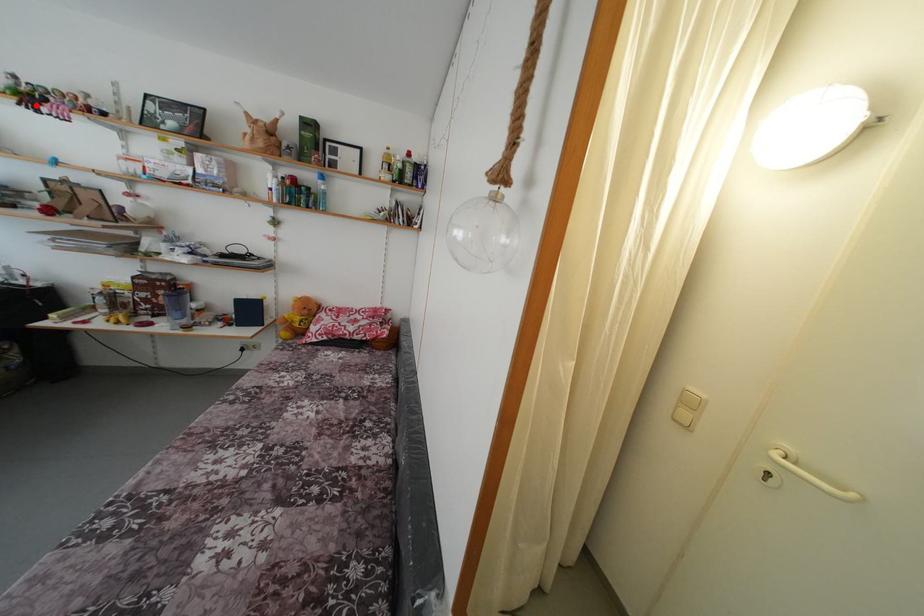
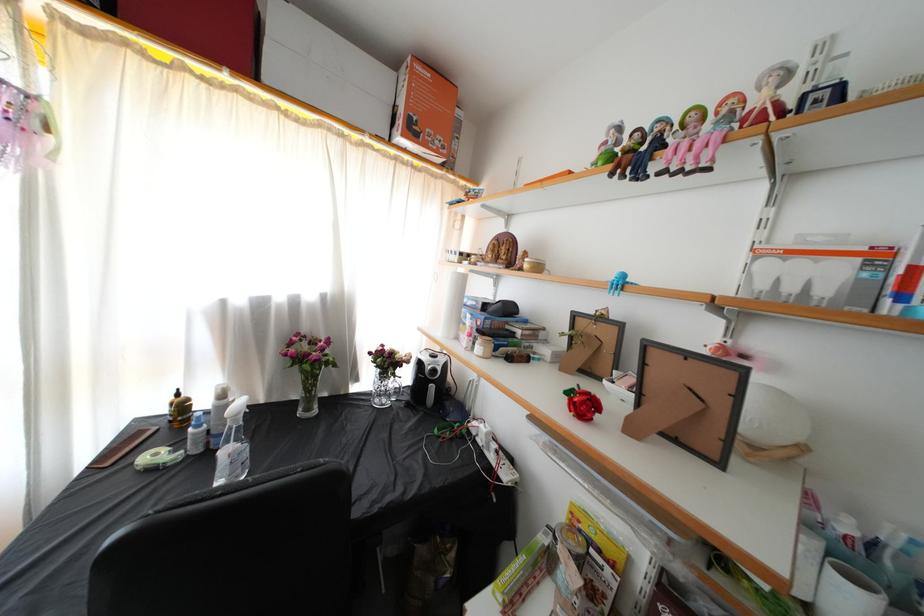
Question: I am providing you with two images of the same scene from different viewpoints. Image1 has a red point marked. In image2, the corresponding 3D location appears at what relative position? Reply with the corresponding letter.

Choices:
 (A) Closer
 (B) Farther

Answer: (A)